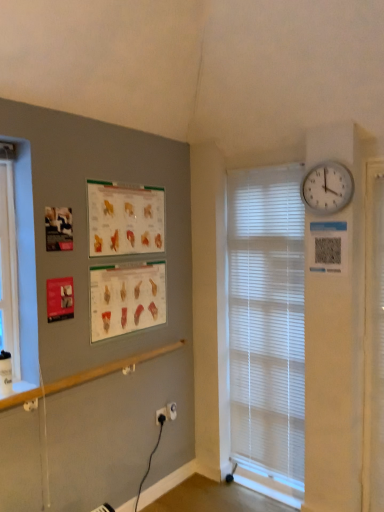
Question: Looking at the image, does white plastic blinds at center seem bigger or smaller compared to white plastic electric outlet at lower center?

Choices:
 (A) small
 (B) big

Answer: (B)

Question: From the image's perspective, is white plastic blinds at center above or below white plastic electric outlet at lower center?

Choices:
 (A) above
 (B) below

Answer: (A)

Question: Which of these objects is positioned farthest from the white plastic blinds at center?

Choices:
 (A) white plastic bay window at left
 (B) matte paper poster at center left, marked as the 2th poster page in a top-to-bottom arrangement
 (C) matte paper poster at center left, which appears as the 2th poster page when ordered from the bottom
 (D) white plastic wall clock at upper right
 (E) white plastic electric outlet at lower center

Answer: (A)

Question: Considering the real-world distances, which object is farthest from the matte paper poster at center left, which appears as the first poster page when ordered from the bottom?

Choices:
 (A) white plastic wall clock at upper right
 (B) matte paper poster at center left, which appears as the 2th poster page when ordered from the bottom
 (C) white plastic blinds at center
 (D) white plastic electric outlet at lower center
 (E) white plastic bay window at left

Answer: (A)